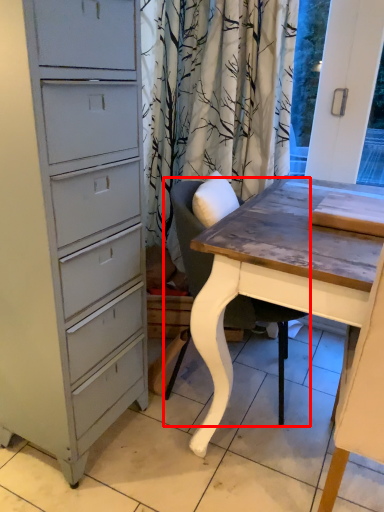
Question: From the image's perspective, where is chair (annotated by the red box) located in relation to table in the image?

Choices:
 (A) below
 (B) above

Answer: (B)